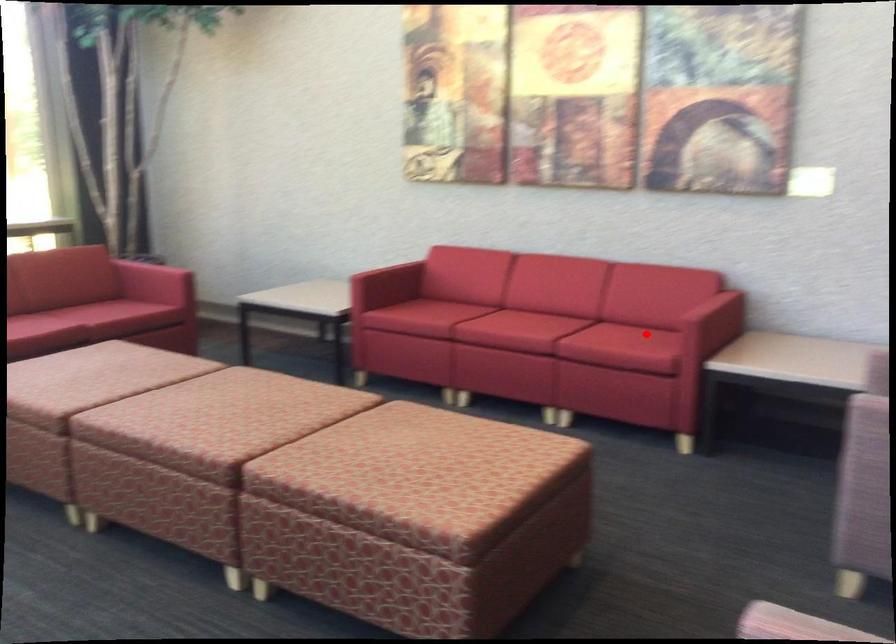
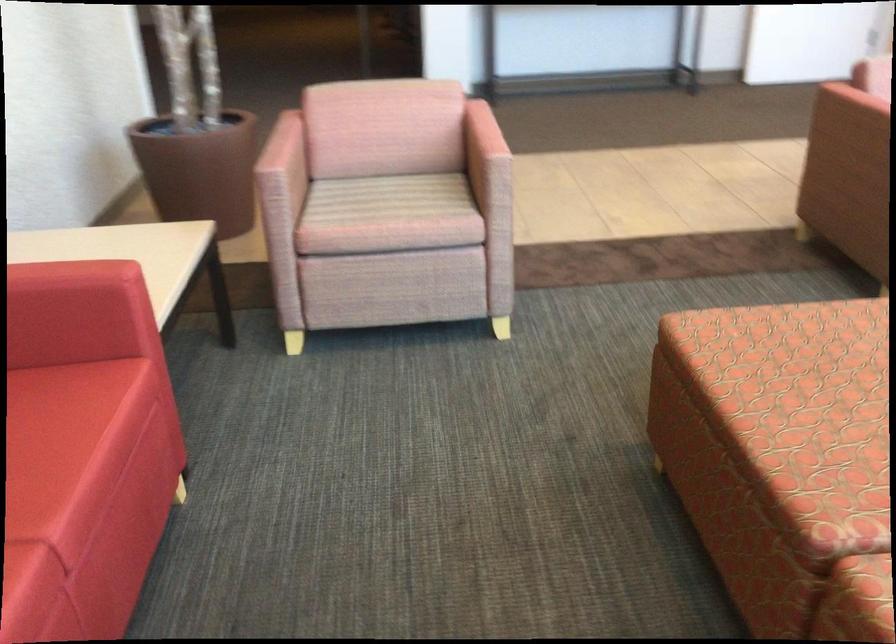
Question: I am providing you with two images of the same scene from different viewpoints. Given a red point in image1, look at the same physical point in image2. Is it:

Choices:
 (A) Closer to the viewpoint
 (B) Farther from the viewpoint

Answer: (A)